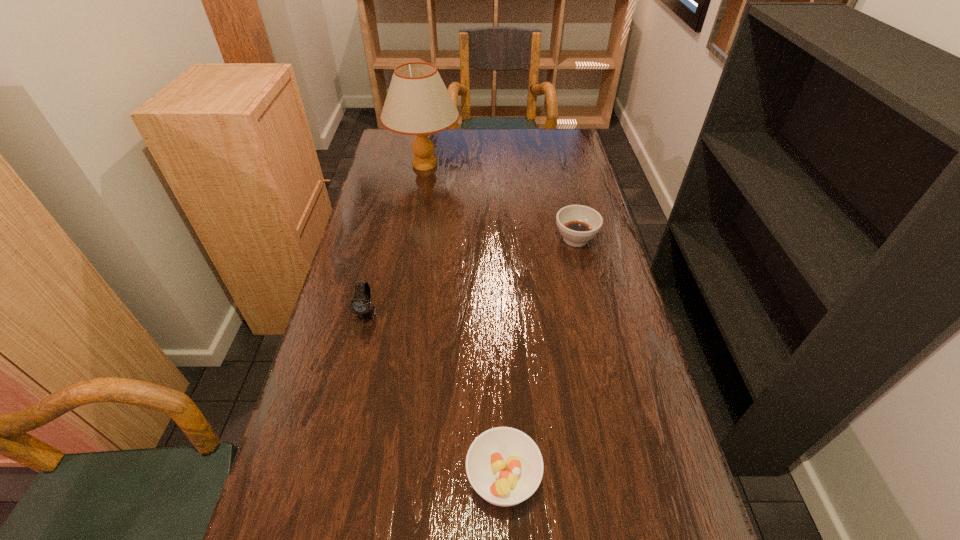
Image resolution: width=960 pixels, height=540 pixels. Identify the location of object that is the second closest to the second tallest object. (x=578, y=224).

Select which soup bowl appears as the closest to the watch. Please provide its 2D coordinates. Your answer should be formatted as a tuple, i.e. [(x, y)], where the tuple contains the x and y coordinates of a point satisfying the conditions above.

[(504, 465)]

The width and height of the screenshot is (960, 540). In order to click on vacant region that satisfies the following two spatial constraints: 1. on the face of the shorter soup bowl; 2. on the right side of the third shortest object in this screenshot , I will do `click(328, 478)`.

Where is `vacant space that satisfies the following two spatial constraints: 1. on the face of the third shortest object; 2. on the right side of the third object from left to right`? The height and width of the screenshot is (540, 960). vacant space that satisfies the following two spatial constraints: 1. on the face of the third shortest object; 2. on the right side of the third object from left to right is located at coordinates (328, 478).